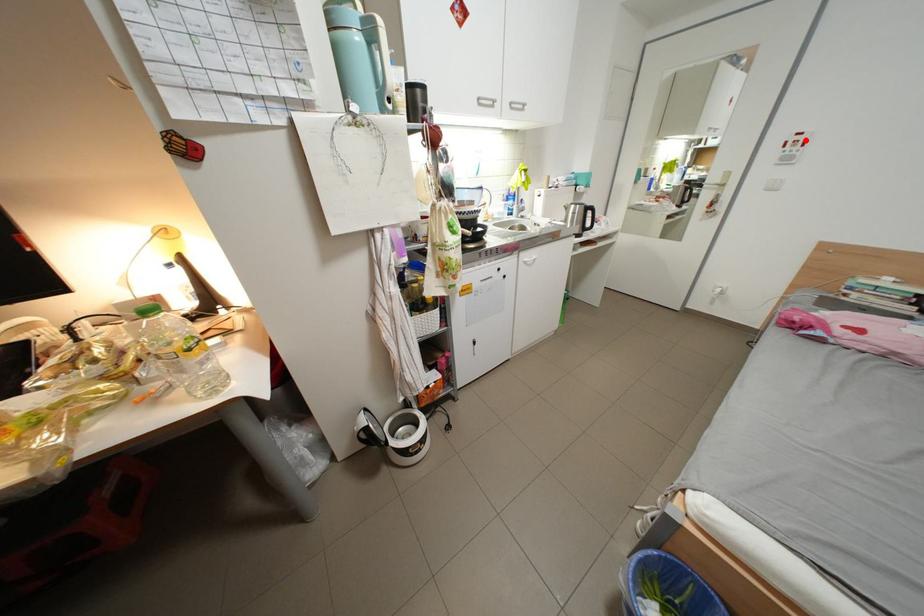
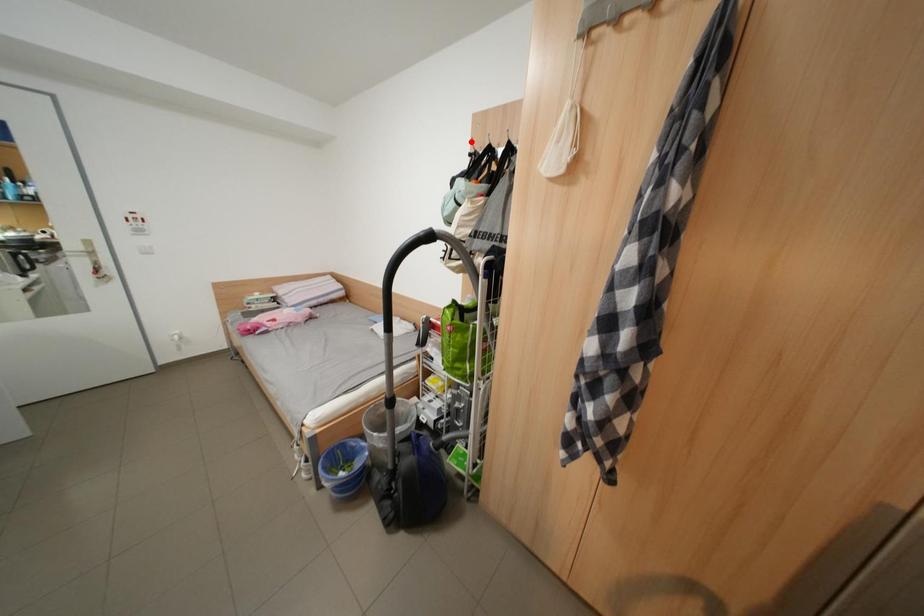
I am providing you with two images of the same scene from different viewpoints. A red point is marked on the first image and another point is marked on the second image. Do the highlighted points in image1 and image2 indicate the same real-world spot?

No